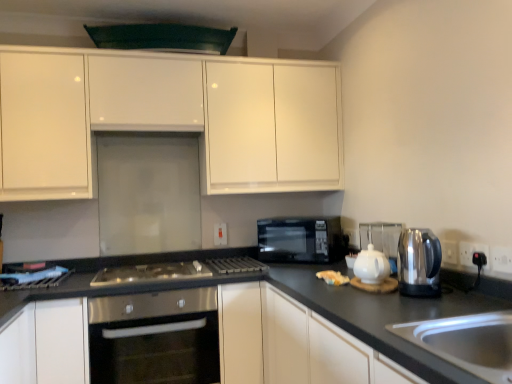
Identify the location of white glossy teapot at center-right. Image resolution: width=512 pixels, height=384 pixels. (371, 265).

I want to click on white ceramic teapot at right, so click(x=381, y=237).

At what (x,y) coordinates should I click in order to perform the action: click on black matte countertop at lower right, which is counted as the second cabinetry, starting from the bottom. Please return your answer as a coordinate pair (x, y). This screenshot has width=512, height=384. Looking at the image, I should click on (318, 348).

Locate an element on the screen. Image resolution: width=512 pixels, height=384 pixels. white plastic electric outlet at center, the first electric outlet in the back-to-front sequence is located at coordinates (220, 234).

Who is smaller, black plastic electric outlet at lower right, which ranks as the 2th electric outlet in left-to-right order, or stainless steel sink at lower right?

Smaller between the two is black plastic electric outlet at lower right, which ranks as the 2th electric outlet in left-to-right order.

Where is `sink in front of the black plastic electric outlet at lower right, placed as the 2th electric outlet when sorted from back to front`? sink in front of the black plastic electric outlet at lower right, placed as the 2th electric outlet when sorted from back to front is located at coordinates (467, 342).

How different are the orientations of black plastic electric outlet at lower right, the 2th electric outlet from the right, and stainless steel sink at lower right in degrees?

The angular difference between black plastic electric outlet at lower right, the 2th electric outlet from the right, and stainless steel sink at lower right is 0.201 degrees.

Could you tell me if black plastic electric outlet at lower right, the second electric outlet when ordered from front to back, is facing stainless steel sink at lower right?

No, black plastic electric outlet at lower right, the second electric outlet when ordered from front to back, is not facing towards stainless steel sink at lower right.

In the scene shown: Which of these two, white glossy cabinets at upper center, which ranks as the 1th cabinetry in top-to-bottom order, or stainless steel sink at lower right, is smaller?

stainless steel sink at lower right is smaller.

Is white glossy cabinets at upper center, which ranks as the 1th cabinetry in top-to-bottom order, directly adjacent to stainless steel sink at lower right?

No.

Which object is thinner, white glossy cabinets at upper center, which ranks as the 1th cabinetry in top-to-bottom order, or stainless steel sink at lower right?

With smaller width is white glossy cabinets at upper center, which ranks as the 1th cabinetry in top-to-bottom order.

Does point (340, 119) appear closer or farther from the camera than point (443, 341)?

Clearly, point (340, 119) is more distant from the camera than point (443, 341).

Is there a large distance between black plastic electric outlet at right, which ranks as the 1th electric outlet in right-to-left order, and stainless steel oven at center?

That's right, there is a large distance between black plastic electric outlet at right, which ranks as the 1th electric outlet in right-to-left order, and stainless steel oven at center.

Considering the relative sizes of black plastic electric outlet at right, marked as the 1th electric outlet in a front-to-back arrangement, and stainless steel oven at center in the image provided, is black plastic electric outlet at right, marked as the 1th electric outlet in a front-to-back arrangement, smaller than stainless steel oven at center?

Yes, black plastic electric outlet at right, marked as the 1th electric outlet in a front-to-back arrangement, is smaller than stainless steel oven at center.

How many degrees apart are the facing directions of black plastic electric outlet at right, which is the third electric outlet from left to right, and stainless steel oven at center?

There is a 89.8-degree angle between the facing directions of black plastic electric outlet at right, which is the third electric outlet from left to right, and stainless steel oven at center.

In the scene shown: Is black plastic electric outlet at right, which is the third electric outlet from left to right, at the left side of stainless steel oven at center?

No, black plastic electric outlet at right, which is the third electric outlet from left to right, is not to the left of stainless steel oven at center.

At what (x,y) coordinates should I click in order to perform the action: click on exhaust hood behind the stainless steel sink at lower right. Please return your answer as a coordinate pair (x, y). Looking at the image, I should click on (162, 37).

Which object is further away from the camera taking this photo, black matte exhaust hood at upper center or stainless steel sink at lower right?

black matte exhaust hood at upper center is behind.

Consider the image. Is black matte exhaust hood at upper center beside stainless steel sink at lower right?

black matte exhaust hood at upper center and stainless steel sink at lower right are clearly separated.

From the image's perspective, which is above, black matte exhaust hood at upper center or stainless steel sink at lower right?

black matte exhaust hood at upper center is shown above in the image.

Is black glass microwave at center surrounded by black plastic electric outlet at lower right, the second electric outlet when ordered from front to back?

No, black plastic electric outlet at lower right, the second electric outlet when ordered from front to back, does not contain black glass microwave at center.

From the image's perspective, is black plastic electric outlet at lower right, which ranks as the 2th electric outlet in left-to-right order, above or below black glass microwave at center?

Based on their image positions, black plastic electric outlet at lower right, which ranks as the 2th electric outlet in left-to-right order, is located above black glass microwave at center.

Is black plastic electric outlet at lower right, placed as the 2th electric outlet when sorted from back to front, bigger than black glass microwave at center?

Incorrect, black plastic electric outlet at lower right, placed as the 2th electric outlet when sorted from back to front, is not larger than black glass microwave at center.

Is point (472, 254) farther from camera compared to point (273, 232)?

No, (472, 254) is closer to viewer.

Based on the photo, does white plastic electric outlet at center, the 3th electric outlet when ordered from front to back, have a lesser width compared to black matte countertop at lower right, the second cabinetry when ordered from top to bottom?

Yes, white plastic electric outlet at center, the 3th electric outlet when ordered from front to back, is thinner than black matte countertop at lower right, the second cabinetry when ordered from top to bottom.

Which is behind, point (224, 232) or point (265, 314)?

The point (224, 232) is farther from the camera.

Between white plastic electric outlet at center, the first electric outlet in the back-to-front sequence, and black matte countertop at lower right, the second cabinetry when ordered from top to bottom, which one has smaller size?

Smaller between the two is white plastic electric outlet at center, the first electric outlet in the back-to-front sequence.

Consider the image. Is white plastic electric outlet at center, which is counted as the 1th electric outlet, starting from the left, surrounding black matte countertop at lower right, the second cabinetry when ordered from top to bottom?

No, black matte countertop at lower right, the second cabinetry when ordered from top to bottom, is not surrounded by white plastic electric outlet at center, which is counted as the 1th electric outlet, starting from the left.

Which object is wider, white matte cabinet at lower left, positioned as the third cabinetry in top-to-bottom order, or stainless steel gas stove at center?

white matte cabinet at lower left, positioned as the third cabinetry in top-to-bottom order, is wider.

From the image's perspective, who appears lower, white matte cabinet at lower left, positioned as the third cabinetry in top-to-bottom order, or stainless steel gas stove at center?

From the image's view, white matte cabinet at lower left, positioned as the third cabinetry in top-to-bottom order, is below.

Choose the correct answer: Is white matte cabinet at lower left, the 1th cabinetry ordered from the bottom, inside stainless steel gas stove at center or outside it?

white matte cabinet at lower left, the 1th cabinetry ordered from the bottom, is located beyond the bounds of stainless steel gas stove at center.

Can you tell me how much white matte cabinet at lower left, positioned as the third cabinetry in top-to-bottom order, and stainless steel gas stove at center differ in facing direction?

The facing directions of white matte cabinet at lower left, positioned as the third cabinetry in top-to-bottom order, and stainless steel gas stove at center are 0.375 degrees apart.

From a real-world perspective, which electric outlet is the 1st one above the stainless steel sink at lower right? Please provide its 2D coordinates.

[(472, 253)]

The height and width of the screenshot is (384, 512). Find the location of `sink that appears below the white glossy cabinets at upper center, which ranks as the 1th cabinetry in top-to-bottom order (from the image's perspective)`. sink that appears below the white glossy cabinets at upper center, which ranks as the 1th cabinetry in top-to-bottom order (from the image's perspective) is located at coordinates (467, 342).

Considering their positions, is white glossy teapot at center-right positioned further to white matte cabinet at lower left, the 1th cabinetry ordered from the bottom, than stainless steel sink at lower right?

stainless steel sink at lower right.

When comparing their distances from white ceramic teapot at right, does stainless steel kettle at right or black matte exhaust hood at upper center seem further?

black matte exhaust hood at upper center is positioned further to the anchor white ceramic teapot at right.

Based on their spatial positions, is white plastic electric outlet at center, which is counted as the 1th electric outlet, starting from the left, or stainless steel oven at center closer to black matte countertop at lower right, the second cabinetry when ordered from top to bottom?

Based on the image, stainless steel oven at center appears to be nearer to black matte countertop at lower right, the second cabinetry when ordered from top to bottom.

Considering their positions, is white glossy teapot at center-right positioned further to stainless steel gas stove at center than stainless steel kettle at right?

stainless steel kettle at right is further to stainless steel gas stove at center.

From the image, which object appears to be nearer to white plastic electric outlet at center, the 3th electric outlet when ordered from front to back, black glass microwave at center or black plastic electric outlet at lower right, the 2th electric outlet from the right?

black glass microwave at center.

Estimate the real-world distances between objects in this image. Which object is further from stainless steel kettle at right, white plastic electric outlet at center, the first electric outlet in the back-to-front sequence, or black matte exhaust hood at upper center?

Based on the image, black matte exhaust hood at upper center appears to be further to stainless steel kettle at right.

Based on their spatial positions, is black glass microwave at center or black matte countertop at lower right, the second cabinetry when ordered from top to bottom, further from white plastic electric outlet at center, which is counted as the 1th electric outlet, starting from the left?

Based on the image, black matte countertop at lower right, the second cabinetry when ordered from top to bottom, appears to be further to white plastic electric outlet at center, which is counted as the 1th electric outlet, starting from the left.

From the image, which object appears to be farther from black matte exhaust hood at upper center, black glass microwave at center or stainless steel kettle at right?

stainless steel kettle at right lies further to black matte exhaust hood at upper center than the other object.

This screenshot has height=384, width=512. What are the coordinates of `oven between stainless steel gas stove at center and black plastic electric outlet at lower right, the second electric outlet when ordered from front to back` in the screenshot? It's located at (155, 338).

I want to click on tea pot between stainless steel sink at lower right and white ceramic teapot at right in the front-back direction, so click(x=371, y=265).

Where is `sink positioned between black matte countertop at lower right, the second cabinetry when ordered from top to bottom, and white glossy cabinets at upper center, which ranks as the 3th cabinetry in bottom-to-top order, from near to far`? Image resolution: width=512 pixels, height=384 pixels. sink positioned between black matte countertop at lower right, the second cabinetry when ordered from top to bottom, and white glossy cabinets at upper center, which ranks as the 3th cabinetry in bottom-to-top order, from near to far is located at coordinates (467, 342).

Identify the location of microwave oven between white glossy teapot at center-right and white plastic electric outlet at center, the first electric outlet in the back-to-front sequence, in the front-back direction. (300, 240).